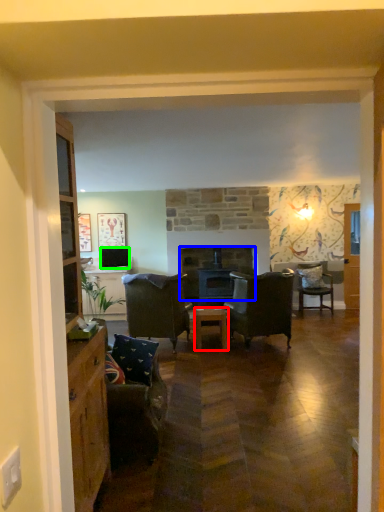
Question: Which object is the closest to the table (highlighted by a red box)? Choose among these: fireplace (highlighted by a blue box) or television (highlighted by a green box).

Choices:
 (A) fireplace
 (B) television

Answer: (A)